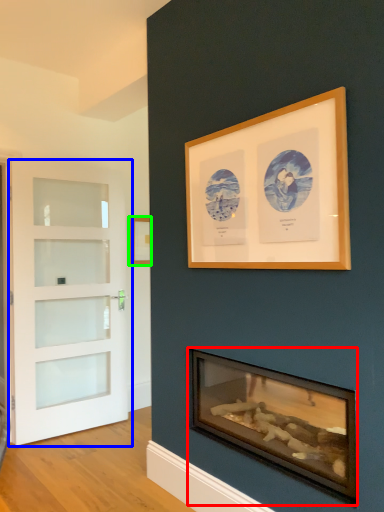
Question: Which object is the farthest from wood burning stove (highlighted by a red box)? Choose among these: door (highlighted by a blue box) or picture frame (highlighted by a green box).

Choices:
 (A) door
 (B) picture frame

Answer: (B)